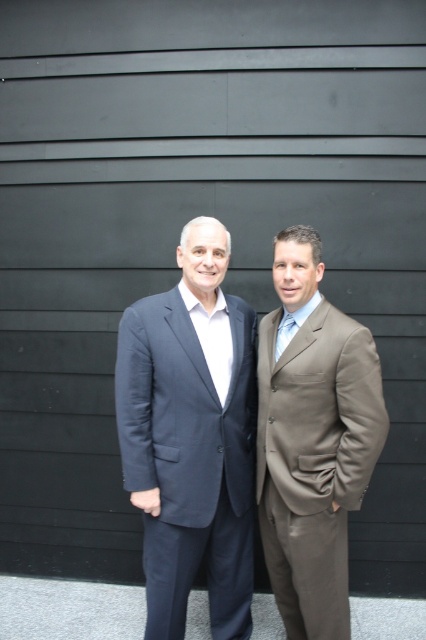
Question: Is matte brown suit at right in front of light blue silk tie at center?

Choices:
 (A) no
 (B) yes

Answer: (B)

Question: Among these points, which one is farthest from the camera?

Choices:
 (A) (215, 301)
 (B) (301, 586)

Answer: (A)

Question: Can you confirm if matte blue suit at center is positioned above matte brown suit at right?

Choices:
 (A) yes
 (B) no

Answer: (B)

Question: Which is nearer to the light blue silk tie at center?

Choices:
 (A) matte brown suit at right
 (B) matte blue suit at center

Answer: (A)

Question: Is matte blue suit at center behind matte brown suit at right?

Choices:
 (A) yes
 (B) no

Answer: (A)

Question: Which object appears farthest from the camera in this image?

Choices:
 (A) matte blue suit at center
 (B) light blue silk tie at center
 (C) matte brown suit at right

Answer: (B)